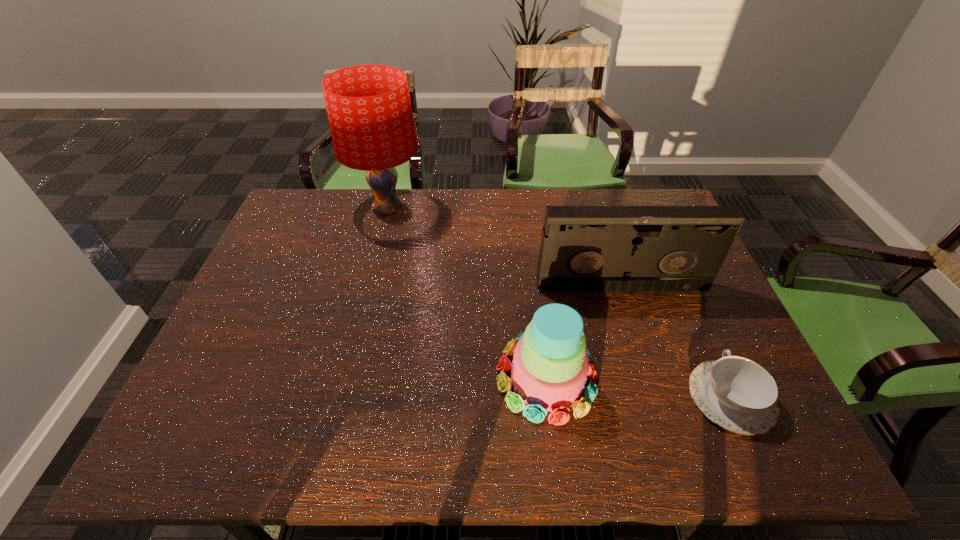
Find the location of a particular element. This screenshot has height=540, width=960. free point located on the handle side of the shortest object is located at coordinates (669, 259).

Where is `vacant area situated 0.260m on the handle side of the shortest object`? The image size is (960, 540). vacant area situated 0.260m on the handle side of the shortest object is located at coordinates (681, 286).

Image resolution: width=960 pixels, height=540 pixels. Find the location of `object present at the far edge`. object present at the far edge is located at coordinates (369, 110).

Where is `cake at the near edge`? This screenshot has height=540, width=960. cake at the near edge is located at coordinates (550, 366).

This screenshot has height=540, width=960. I want to click on chinaware situated at the near edge, so click(736, 393).

The image size is (960, 540). What are the coordinates of `videotape that is at the right edge` in the screenshot? It's located at (583, 248).

Identify the location of chinaware present at the right edge. The height and width of the screenshot is (540, 960). (736, 393).

Locate an element on the screen. object located in the near right corner section of the desktop is located at coordinates (736, 393).

Locate an element on the screen. The width and height of the screenshot is (960, 540). free spot at the far edge of the desktop is located at coordinates (444, 191).

Identify the location of blank space at the near edge. Image resolution: width=960 pixels, height=540 pixels. pyautogui.click(x=592, y=426).